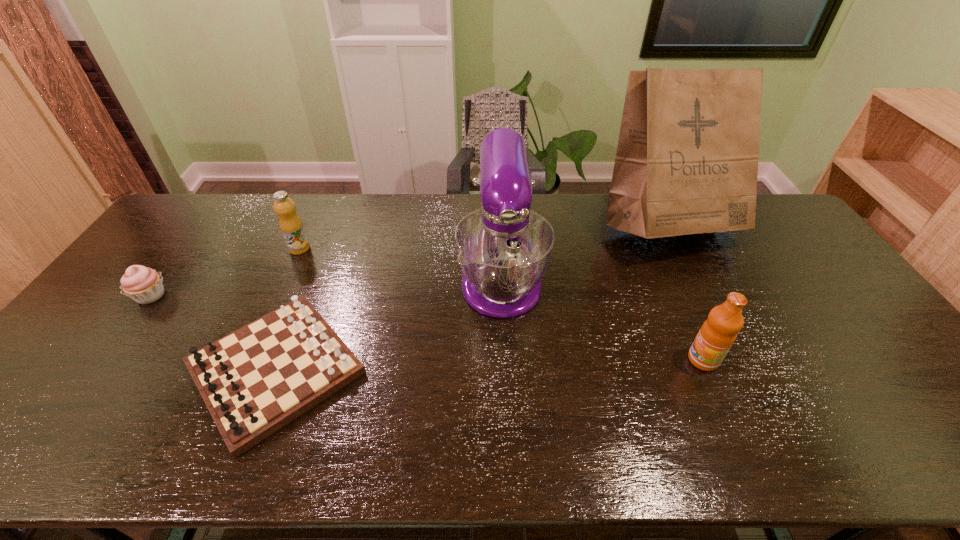
At what (x,y) coordinates should I click in order to perform the action: click on grocery bag. Please return your answer as a coordinate pair (x, y). The height and width of the screenshot is (540, 960). Looking at the image, I should click on (687, 156).

This screenshot has height=540, width=960. I want to click on the third object from right to left, so click(504, 248).

You are a GUI agent. You are given a task and a screenshot of the screen. Output one action in this format:
    pyautogui.click(x=<x>, y=<y>)
    Task: Click on the fifth shortest object
    The height and width of the screenshot is (540, 960).
    Given the screenshot: What is the action you would take?
    pyautogui.click(x=504, y=248)

Where is `the right fruit juice`? the right fruit juice is located at coordinates (718, 333).

Locate an element on the screen. Image resolution: width=960 pixels, height=540 pixels. the farther fruit juice is located at coordinates (291, 226).

This screenshot has height=540, width=960. Find the location of `the leftmost object`. the leftmost object is located at coordinates (144, 285).

Find the location of a particular element. This screenshot has width=960, height=540. cupcake is located at coordinates [144, 285].

Where is `chessboard`? chessboard is located at coordinates (254, 381).

At what (x,y) coordinates should I click in order to perform the action: click on blank space located on the left of the tallest object. Please return your answer as a coordinate pair (x, y). Looking at the image, I should click on (541, 228).

This screenshot has width=960, height=540. Identify the location of vacant space located 0.090m at the bowl opening of the third object from right to left. (505, 355).